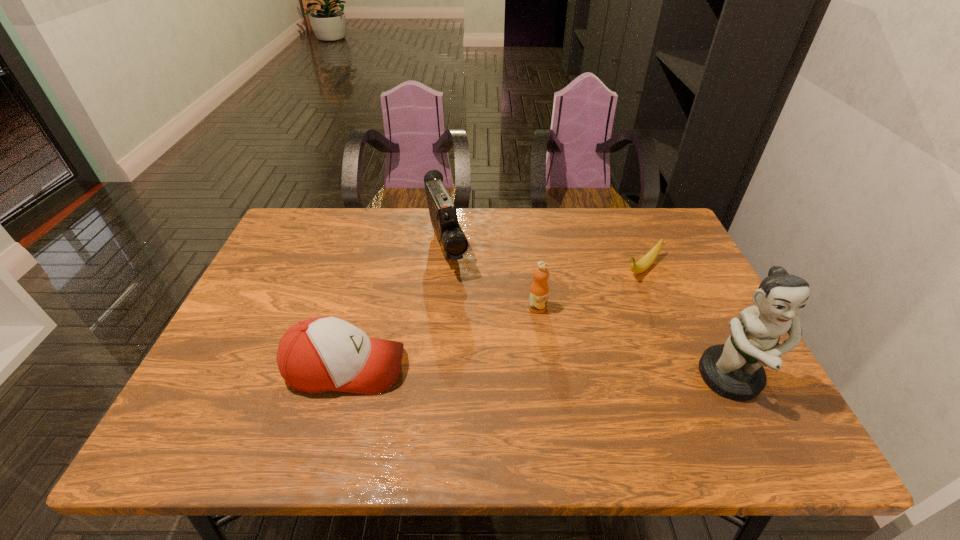
The image size is (960, 540). In order to click on vacant spot on the desktop that is between the baseball cap and the figurine and is positioned on the front-facing side of the fourth shortest object in this screenshot , I will do `click(501, 372)`.

Where is `vacant space on the desktop that is between the baseball cap and the tallest object and is positioned on the front label of the third object from left to right`? Image resolution: width=960 pixels, height=540 pixels. vacant space on the desktop that is between the baseball cap and the tallest object and is positioned on the front label of the third object from left to right is located at coordinates (590, 375).

Find the location of `vacant space on the desktop that is between the leftmost object and the tallest object and is positioned at the stem of the banana`. vacant space on the desktop that is between the leftmost object and the tallest object and is positioned at the stem of the banana is located at coordinates 527,373.